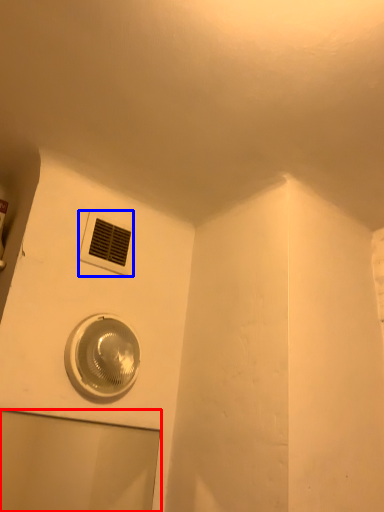
Question: Which object is further to the camera taking this photo, glass door (highlighted by a red box) or air conditioning (highlighted by a blue box)?

Choices:
 (A) glass door
 (B) air conditioning

Answer: (B)